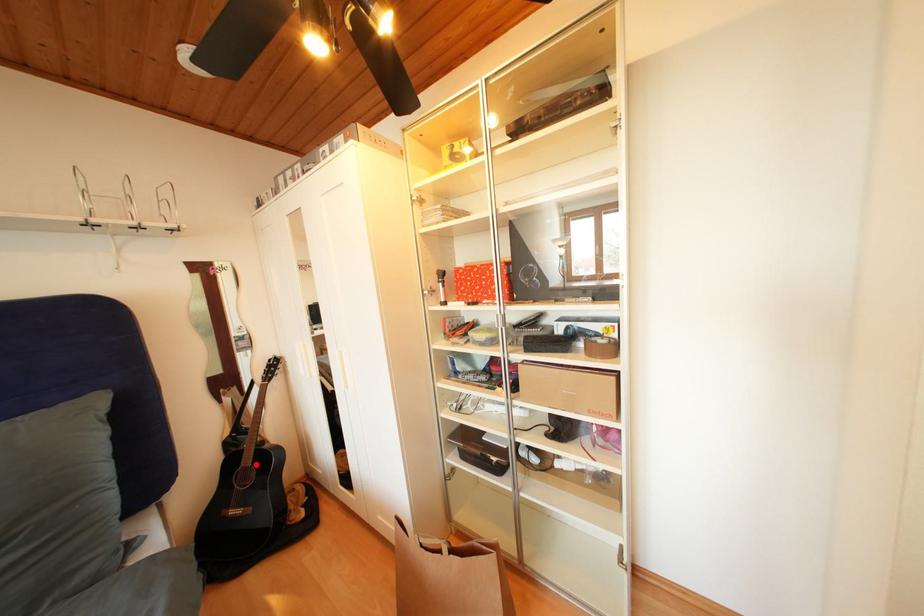
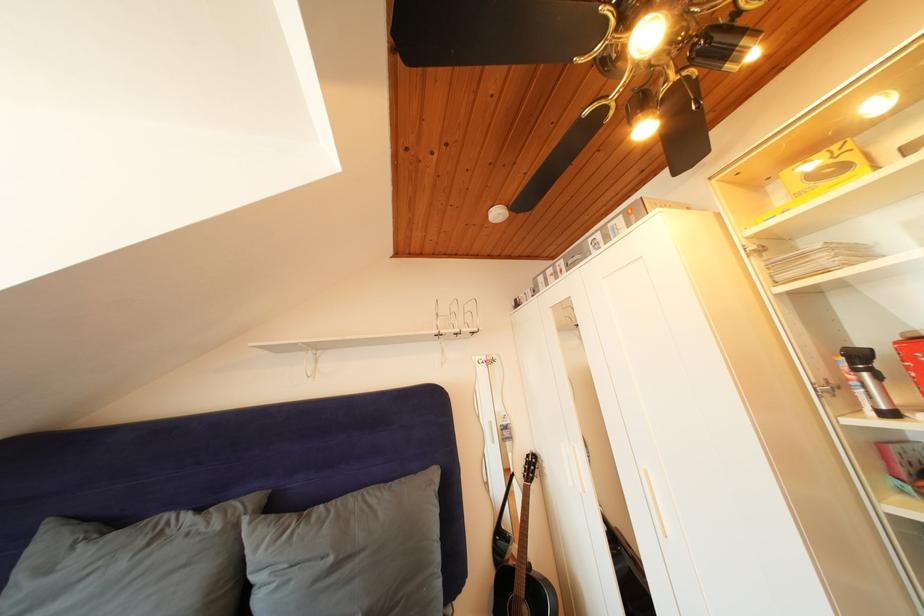
Question: I am providing you with two images of the same scene from different viewpoints. A red point is marked on the first image. At the location where the point appears in image 1, is it still visible in image 2?

Choices:
 (A) Yes
 (B) No

Answer: (A)